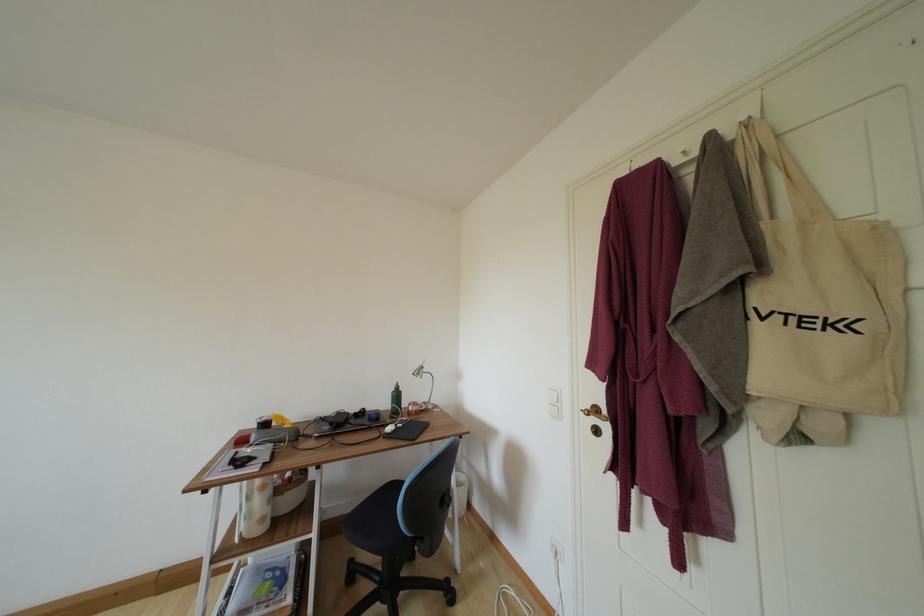
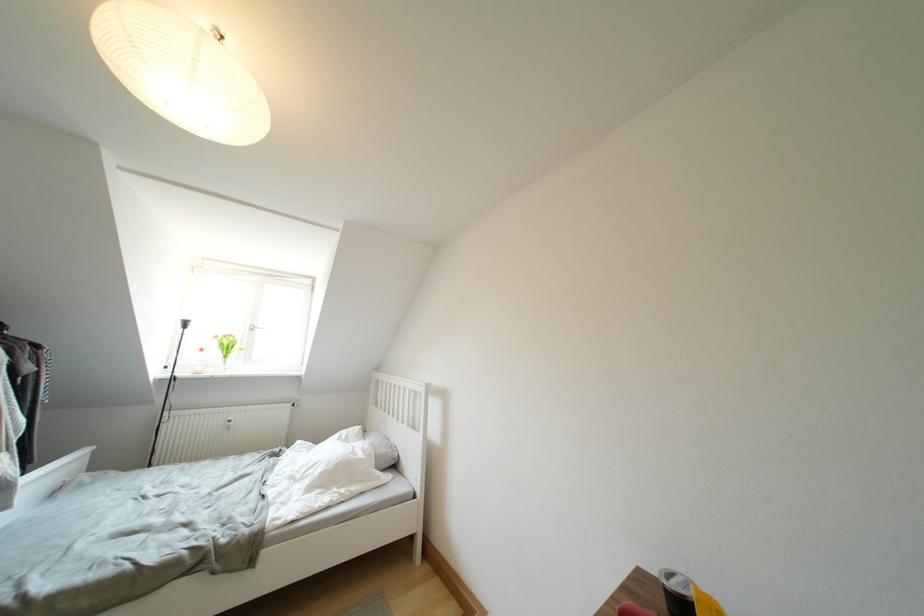
Where in the second image is the point corresponding to pixel 269 424 from the first image?

(678, 589)